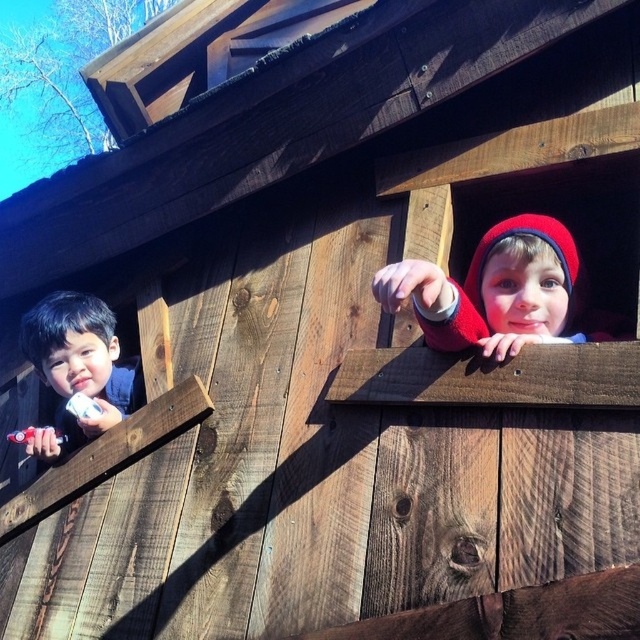
You are standing in front of the wooden structure and want to place a sticker on the point closer to you. Which point should you choose between point (99, 314) and point (525, 333)?

Point (99, 314) is closer to you, so you should choose that point.

You are a parent looking at the image of two children playing. You need to determine if the smooth skin boy at left is currently holding the matte white toothbrush at left. Based on the spatial arrangement, can you confirm this?

The smooth skin boy at left is positioned under the matte white toothbrush at left, which suggests that the toothbrush is above him. Since the boy is holding a small toy gun, it is unlikely he is holding the toothbrush at the same time. Therefore, the smooth skin boy at left is not currently holding the matte white toothbrush at left.

You are a parent trying to take a photo of the children. You want to ensure both the smooth skin boy at left and the other child are in focus. The camera you are using has a depth of field that can cover 2 meters. Will both children be in focus?

The smooth skin boy at left and the other child are 2.07 meters apart. Since the camera can cover 2 meters, the distance between them exceeds the depth of field, so not both will be in focus.